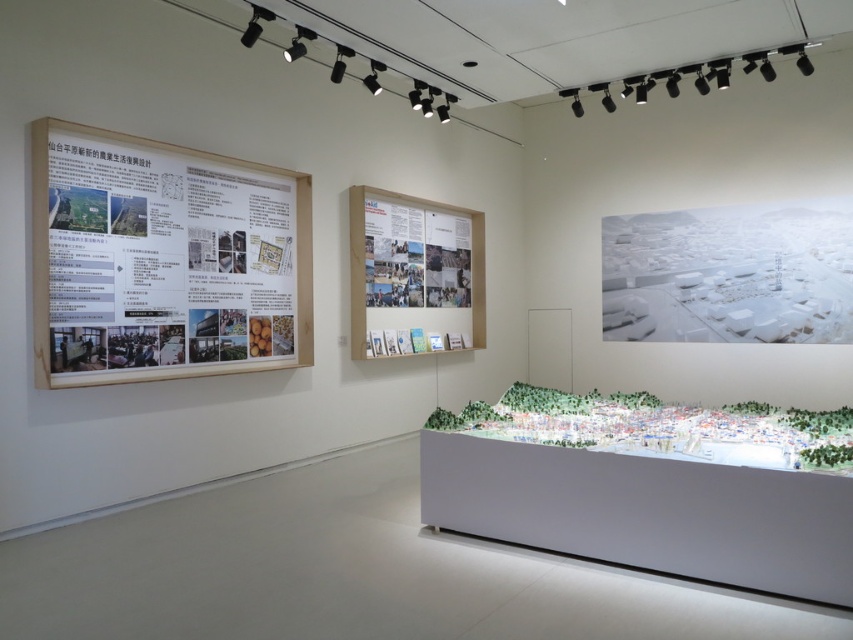
Question: Which point is closer to the camera?

Choices:
 (A) (381, 228)
 (B) (235, 228)

Answer: (B)

Question: Which object is the farthest from the wooden frame poster at upper left?

Choices:
 (A) wooden frame at center
 (B) matte paper poster at center
 (C) white matte cityscape at center

Answer: (C)

Question: Does wooden frame poster at upper left come in front of matte paper poster at center?

Choices:
 (A) no
 (B) yes

Answer: (B)

Question: Which of the following is the closest to the observer?

Choices:
 (A) (643, 234)
 (B) (404, 278)
 (C) (245, 257)

Answer: (C)

Question: Is white matte cityscape at center positioned before wooden frame at center?

Choices:
 (A) no
 (B) yes

Answer: (A)

Question: Does white matte cityscape at center have a larger size compared to wooden frame at center?

Choices:
 (A) no
 (B) yes

Answer: (B)